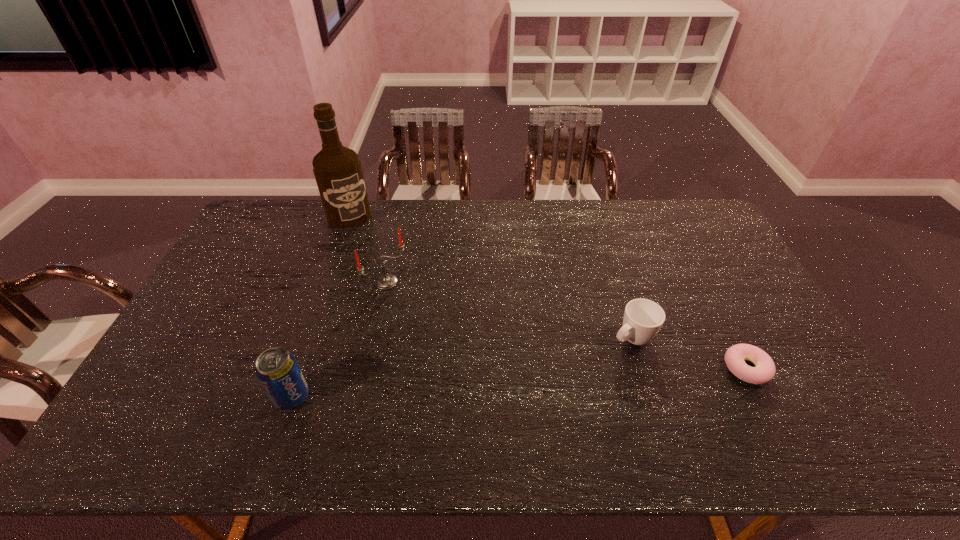
Identify the location of the third shortest object. (277, 370).

The height and width of the screenshot is (540, 960). In order to click on the shortest object in this screenshot , I will do `click(764, 371)`.

You are a GUI agent. You are given a task and a screenshot of the screen. Output one action in this format:
    pyautogui.click(x=<x>, y=<y>)
    Task: Click on the rightmost object
    Image resolution: width=960 pixels, height=540 pixels.
    Given the screenshot: What is the action you would take?
    pyautogui.click(x=764, y=371)

Identify the location of the third object from right to left. This screenshot has width=960, height=540. (386, 281).

Image resolution: width=960 pixels, height=540 pixels. What are the coordinates of `candle` in the screenshot? It's located at (386, 281).

The width and height of the screenshot is (960, 540). Find the location of `the second object from right to left`. the second object from right to left is located at coordinates (x=643, y=318).

Find the location of a particular element. The image size is (960, 540). the fourth tallest object is located at coordinates (643, 318).

Where is `the tallest object`? the tallest object is located at coordinates (337, 169).

At what (x,y) coordinates should I click in order to perform the action: click on alcohol. Please return your answer as a coordinate pair (x, y). The width and height of the screenshot is (960, 540). Looking at the image, I should click on (337, 169).

Where is `free point located on the left of the soda`? This screenshot has width=960, height=540. free point located on the left of the soda is located at coordinates (175, 396).